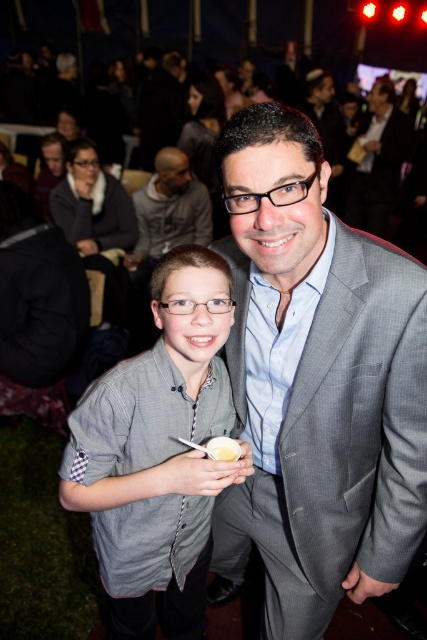
You are a photographer at the event and want to capture a photo that includes both the gray striped shirt at center and the dark gray suit at upper center. Based on their positions, which one should be placed on the left side of the photo?

The gray striped shirt at center should be placed on the left side of the photo because it is already positioned on the left side of the dark gray suit at upper center in the image.

You are organizing a photo shoot and need to ensure that the gray striped shirt at center and the gray hoodie at upper center are visible in the frame. Given their sizes, which one might require more space in the composition?

The gray striped shirt at center is larger in size than the gray hoodie at upper center, so it would require more space in the composition to ensure visibility.